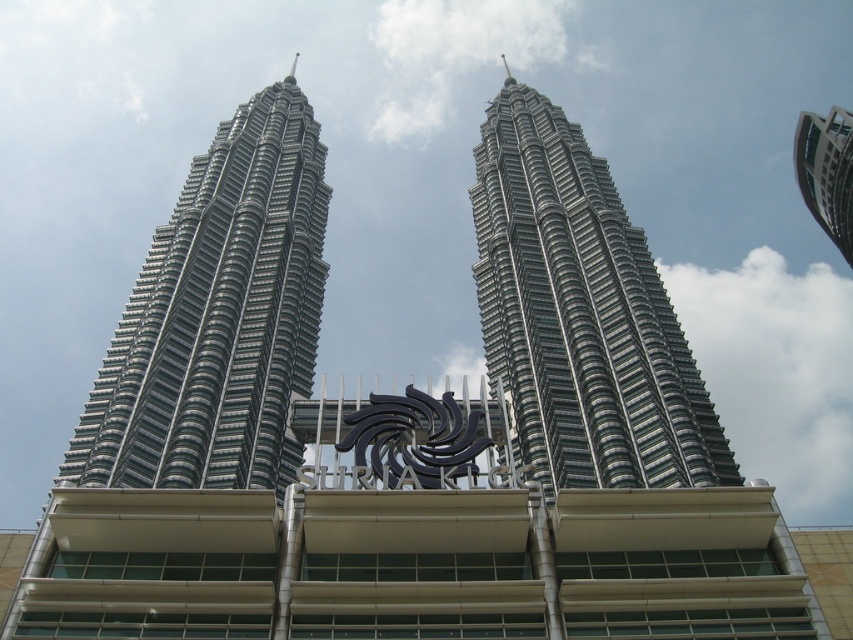
You are standing at the base of the Petronas Twin Towers and looking up. You see the silver metallic building at center and the silver metallic building at upper right. Which one is positioned higher in the sky?

The silver metallic building at upper right is positioned higher in the sky than the silver metallic building at center.

You are standing at the point marked by the coordinates point [218,316] in the image. Looking around, you see the Petronas Twin Towers and the Suria KLCC shopping mall. Which building are you facing directly?

The point [218,316] corresponds to the silver metallic building at center, which is the Suria KLCC shopping mall at the base of the Petronas Twin Towers.

You are a photographer planning to capture a wide shot of the silver metallic building at center and the black metal logo at center. Considering their sizes, which object should you focus on first to ensure both are in frame?

The silver metallic building at center is bigger than the black metal logo at center, so you should focus on the silver metallic building at center first to ensure both are in frame.